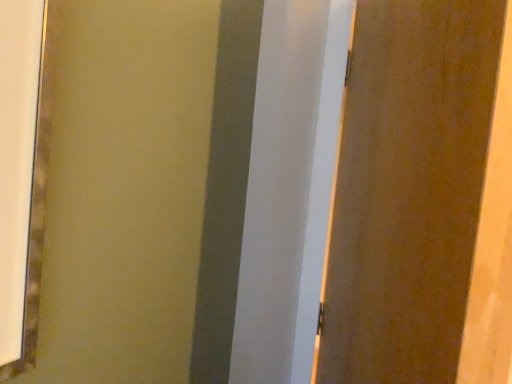
Identify the location of brown matte door at right. (423, 199).

Describe the element at coordinates (423, 199) in the screenshot. This screenshot has height=384, width=512. I see `brown matte door at right` at that location.

The width and height of the screenshot is (512, 384). I want to click on brown matte door at right, so click(x=423, y=199).